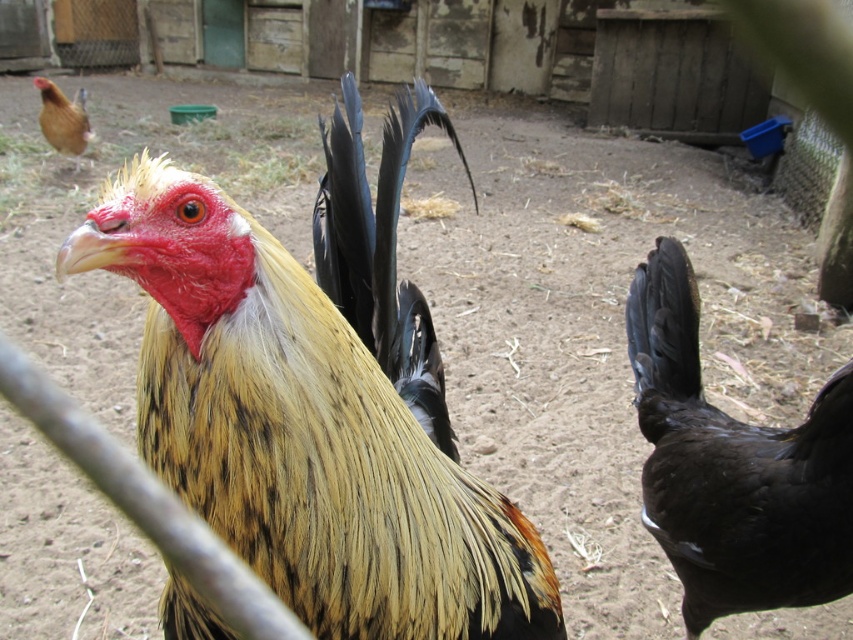
Who is more distant from viewer, (699, 620) or (62, 134)?

Positioned behind is point (62, 134).

Which of these two, black glossy feathers at right or brown feathered chicken at upper left, stands shorter?

With less height is brown feathered chicken at upper left.

In order to click on black glossy feathers at right in this screenshot , I will do `click(733, 467)`.

At what (x,y) coordinates should I click in order to perform the action: click on black glossy feathers at right. Please return your answer as a coordinate pair (x, y). This screenshot has width=853, height=640. Looking at the image, I should click on (733, 467).

Can you confirm if golden-yellow feathers at center is positioned to the right of black glossy feathers at right?

Incorrect, golden-yellow feathers at center is not on the right side of black glossy feathers at right.

Does golden-yellow feathers at center have a larger size compared to black glossy feathers at right?

Indeed, golden-yellow feathers at center has a larger size compared to black glossy feathers at right.

Is point (117, 200) less distant than point (756, 472)?

Yes, it is.

At what (x,y) coordinates should I click in order to perform the action: click on golden-yellow feathers at center. Please return your answer as a coordinate pair (x, y). Looking at the image, I should click on (315, 401).

Who is more forward, (x=370, y=560) or (x=45, y=125)?

Point (x=370, y=560) is in front.

Who is more distant from viewer, (405,426) or (77,99)?

The point (77,99) is more distant.

The height and width of the screenshot is (640, 853). I want to click on golden-yellow feathers at center, so [315, 401].